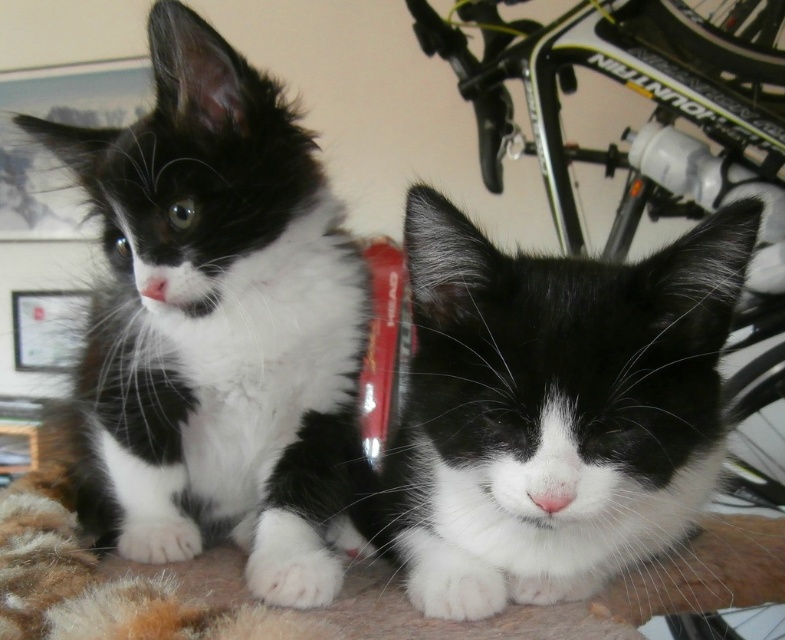
Question: Can you confirm if black and white fur cat at left is positioned below black soft fur cat at center?

Choices:
 (A) yes
 (B) no

Answer: (B)

Question: Which object appears farthest from the camera in this image?

Choices:
 (A) black and white fur cat at left
 (B) black soft fur cat at center

Answer: (A)

Question: In this image, where is black and white fur cat at left located relative to black soft fur cat at center?

Choices:
 (A) below
 (B) above

Answer: (B)

Question: Which point is farther from the camera taking this photo?

Choices:
 (A) (218, 432)
 (B) (632, 428)

Answer: (A)

Question: Can you confirm if black and white fur cat at left is positioned to the left of black soft fur cat at center?

Choices:
 (A) yes
 (B) no

Answer: (A)